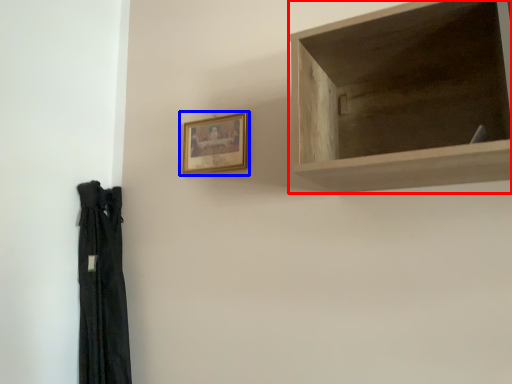
Question: Which object appears farthest to the camera in this image, shelf (highlighted by a red box) or picture frame (highlighted by a blue box)?

Choices:
 (A) shelf
 (B) picture frame

Answer: (B)